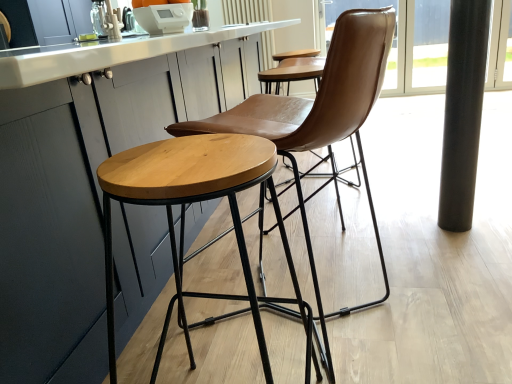
Identify the location of vacant space behind black polished pole at right. The width and height of the screenshot is (512, 384). (420, 204).